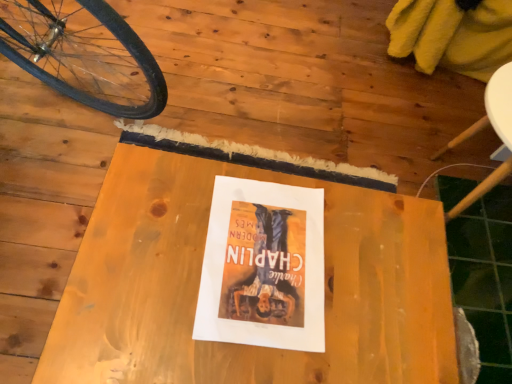
Question: Is white paper at center thinner than wooden table at center?

Choices:
 (A) yes
 (B) no

Answer: (A)

Question: Is white paper at center to the right of wooden table at center from the viewer's perspective?

Choices:
 (A) yes
 (B) no

Answer: (A)

Question: Considering the relative sizes of white paper at center and wooden table at center in the image provided, is white paper at center taller than wooden table at center?

Choices:
 (A) no
 (B) yes

Answer: (A)

Question: Is the position of white paper at center less distant than that of wooden table at center?

Choices:
 (A) no
 (B) yes

Answer: (A)

Question: Is white paper at center to the left of wooden table at center from the viewer's perspective?

Choices:
 (A) yes
 (B) no

Answer: (B)

Question: Would you say white paper at center is a long distance from wooden table at center?

Choices:
 (A) no
 (B) yes

Answer: (A)

Question: Does wooden table at center have a greater width compared to white paper at center?

Choices:
 (A) no
 (B) yes

Answer: (B)

Question: Considering the relative sizes of wooden table at center and white paper at center in the image provided, is wooden table at center thinner than white paper at center?

Choices:
 (A) no
 (B) yes

Answer: (A)

Question: From a real-world perspective, is wooden table at center positioned under white paper at center based on gravity?

Choices:
 (A) yes
 (B) no

Answer: (A)

Question: Could you tell me if wooden table at center is facing white paper at center?

Choices:
 (A) yes
 (B) no

Answer: (B)

Question: From the image's perspective, is wooden table at center on white paper at center?

Choices:
 (A) yes
 (B) no

Answer: (B)

Question: Does wooden table at center appear on the right side of white paper at center?

Choices:
 (A) no
 (B) yes

Answer: (A)

Question: Is point (352, 370) positioned closer to the camera than point (302, 327)?

Choices:
 (A) closer
 (B) farther

Answer: (A)